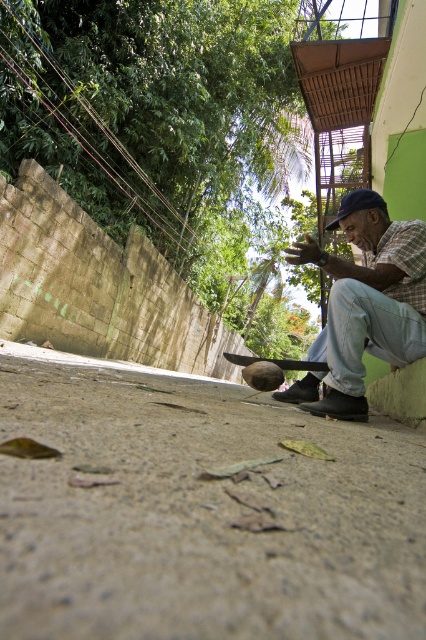
Could you measure the distance between gray concrete pavement at lower center and dark blue fabric baseball cap at center?

gray concrete pavement at lower center and dark blue fabric baseball cap at center are 6.31 feet apart from each other.

Is gray concrete pavement at lower center shorter than dark blue fabric baseball cap at center?

No.

Is point (63, 557) closer to viewer compared to point (356, 204)?

Yes, point (63, 557) is in front of point (356, 204).

What are the coordinates of `gray concrete pavement at lower center` in the screenshot? It's located at (199, 512).

Does light blue denim jeans at lower right appear over dark blue fabric baseball cap at center?

Actually, light blue denim jeans at lower right is below dark blue fabric baseball cap at center.

Who is positioned more to the right, light blue denim jeans at lower right or dark blue fabric baseball cap at center?

Positioned to the right is dark blue fabric baseball cap at center.

You are a GUI agent. You are given a task and a screenshot of the screen. Output one action in this format:
    pyautogui.click(x=<x>, y=<y>)
    Task: Click on the light blue denim jeans at lower right
    Image resolution: width=426 pixels, height=640 pixels.
    Given the screenshot: What is the action you would take?
    pyautogui.click(x=363, y=305)

Where is `light blue denim jeans at lower right`? The image size is (426, 640). light blue denim jeans at lower right is located at coordinates (363, 305).

Which of these two, gray concrete pavement at lower center or light blue denim jeans at lower right, stands shorter?

gray concrete pavement at lower center

Could you measure the distance between gray concrete pavement at lower center and light blue denim jeans at lower right?

gray concrete pavement at lower center and light blue denim jeans at lower right are 37.56 inches apart.

Where is `gray concrete pavement at lower center`? gray concrete pavement at lower center is located at coordinates (199, 512).